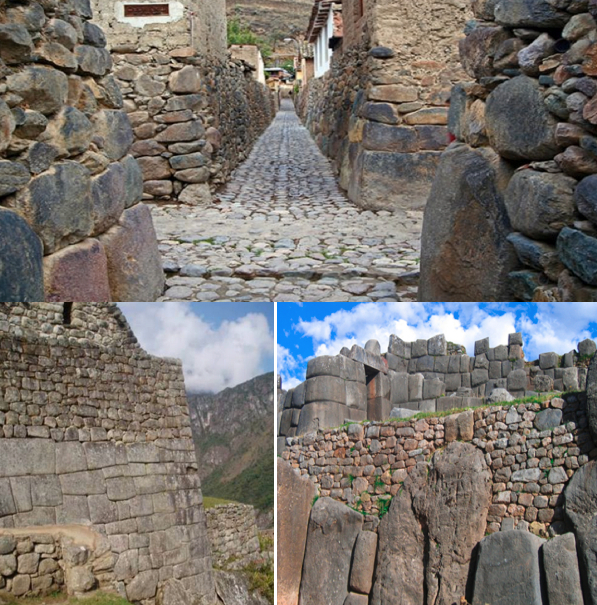
This screenshot has height=605, width=597. I want to click on open doorway, so click(372, 383).